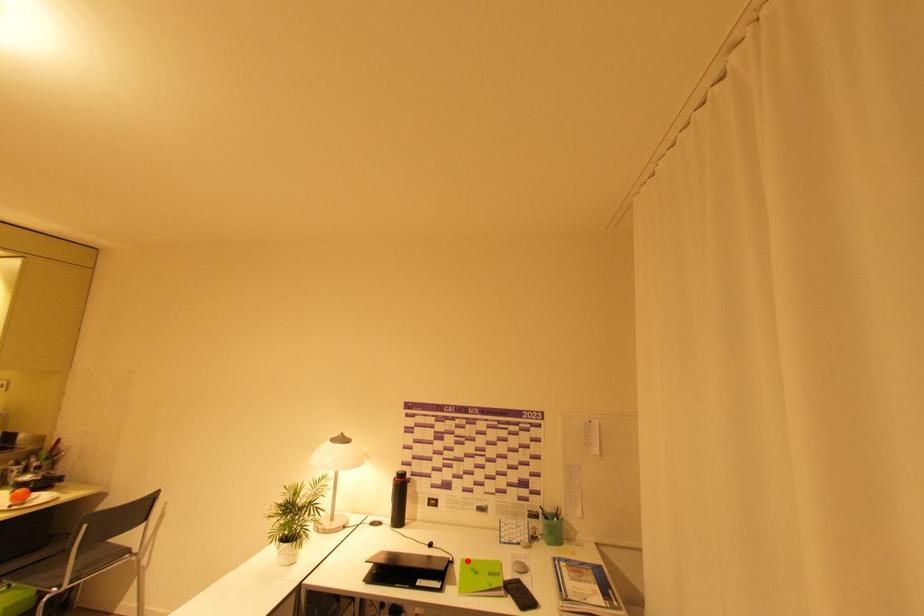
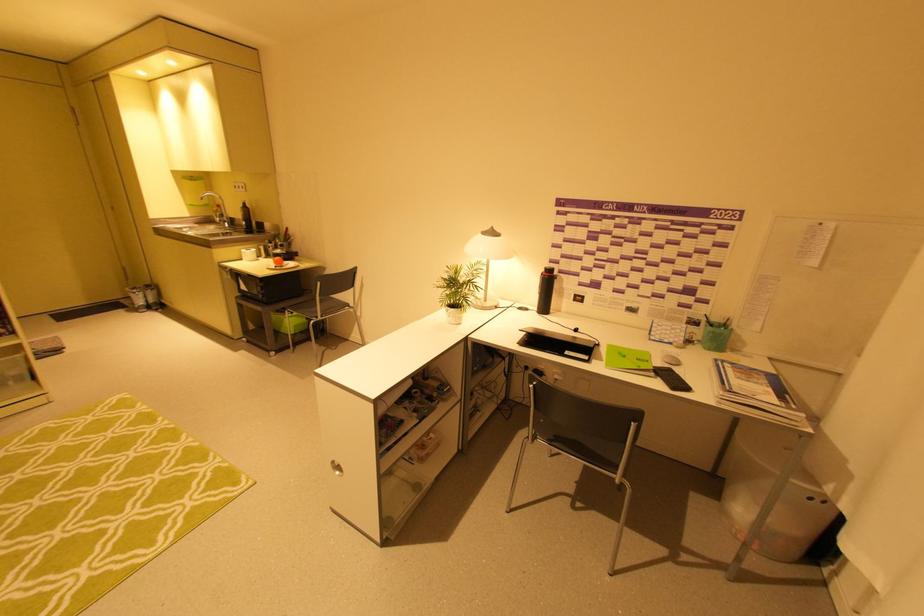
The point at the highlighted location is marked in the first image. Where is the corresponding point in the second image?

(614, 346)